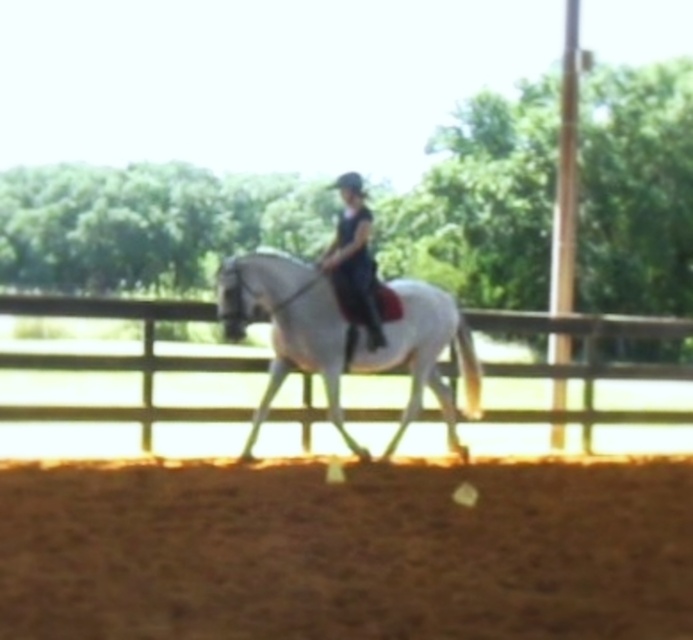
Question: Which point is closer to the camera?

Choices:
 (A) brown sandy dirt track at lower center
 (B) white glossy horse at center
 (C) brown wooden fence at center

Answer: (A)

Question: Which point is closer to the camera taking this photo?

Choices:
 (A) coord(554,323)
 (B) coord(446,397)

Answer: (B)

Question: Which is farther from the brown sandy dirt track at lower center?

Choices:
 (A) white glossy horse at center
 (B) brown wooden fence at center

Answer: (B)

Question: Does brown sandy dirt track at lower center have a lesser width compared to brown wooden fence at center?

Choices:
 (A) yes
 (B) no

Answer: (A)

Question: Does brown sandy dirt track at lower center appear on the left side of white glossy horse at center?

Choices:
 (A) no
 (B) yes

Answer: (B)

Question: Is the position of brown wooden fence at center less distant than that of white glossy horse at center?

Choices:
 (A) no
 (B) yes

Answer: (A)